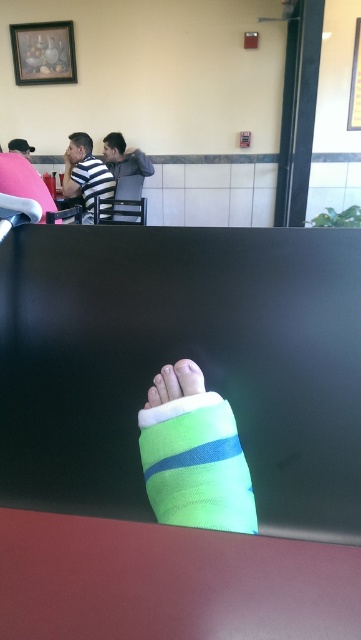
Does striped cotton shirt at upper left have a greater height compared to striped fabric shirt at upper center?

Yes, striped cotton shirt at upper left is taller than striped fabric shirt at upper center.

Who is lower down, striped cotton shirt at upper left or striped fabric shirt at upper center?

striped cotton shirt at upper left is below.

Where is `striped cotton shirt at upper left`? Image resolution: width=361 pixels, height=640 pixels. striped cotton shirt at upper left is located at coordinates (85, 173).

Where is `striped cotton shirt at upper left`? striped cotton shirt at upper left is located at coordinates (85, 173).

Who is more distant from viewer, (155,502) or (124,205)?

Point (124,205)

Looking at this image, can you confirm if green fabric sock at lower center is smaller than striped fabric shirt at upper center?

Yes, green fabric sock at lower center is smaller than striped fabric shirt at upper center.

Is point (202, 419) positioned before point (137, 168)?

Yes, point (202, 419) is in front of point (137, 168).

At what (x,y) coordinates should I click in order to perform the action: click on green fabric sock at lower center. Please return your answer as a coordinate pair (x, y). The width and height of the screenshot is (361, 640). Looking at the image, I should click on (196, 465).

Is striped cotton shirt at upper left further to the viewer compared to green fabric bandage at center?

Yes.

Where is `striped cotton shirt at upper left`? The image size is (361, 640). striped cotton shirt at upper left is located at coordinates (85, 173).